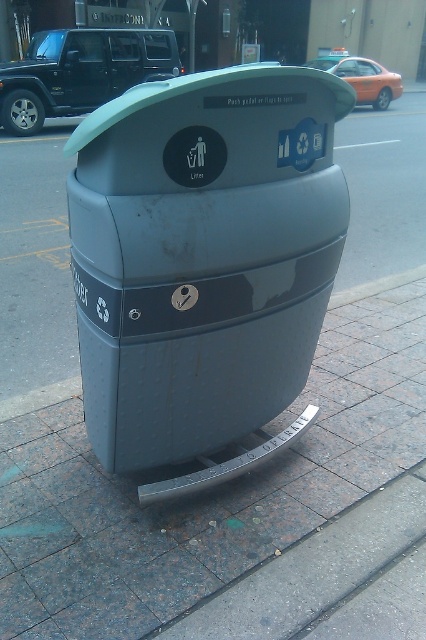
Looking at this image, can you confirm if matte gray trash can at center is bigger than black matte suv at upper left?

No.

Can you confirm if matte gray trash can at center is wider than black matte suv at upper left?

No.

Is point (89, 244) positioned behind point (103, 61)?

No, (89, 244) is in front of (103, 61).

Where is `matte gray trash can at center`? The height and width of the screenshot is (640, 426). matte gray trash can at center is located at coordinates (203, 256).

Between black matte suv at upper left and orange matte car at upper right, which one is positioned lower?

black matte suv at upper left is lower down.

Is black matte suv at upper left bigger than orange matte car at upper right?

Correct, black matte suv at upper left is larger in size than orange matte car at upper right.

Find the location of `black matte suv at upper left`. black matte suv at upper left is located at coordinates (80, 72).

Is matte gray trash can at center taller than orange matte car at upper right?

Correct, matte gray trash can at center is much taller as orange matte car at upper right.

Does point (201, 436) lie behind point (359, 77)?

No.

Identify the location of matte gray trash can at center. The height and width of the screenshot is (640, 426). (203, 256).